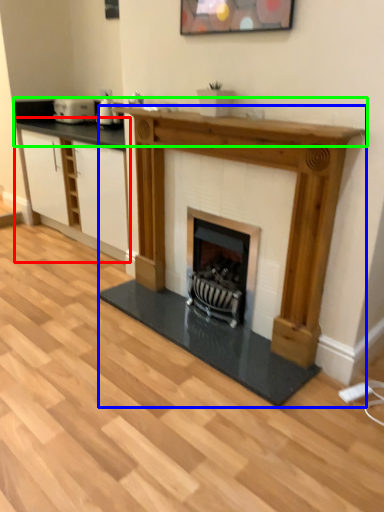
Question: Which is farther away from cabinetry (highlighted by a red box)? fireplace (highlighted by a blue box) or counter top (highlighted by a green box)?

Choices:
 (A) fireplace
 (B) counter top

Answer: (A)